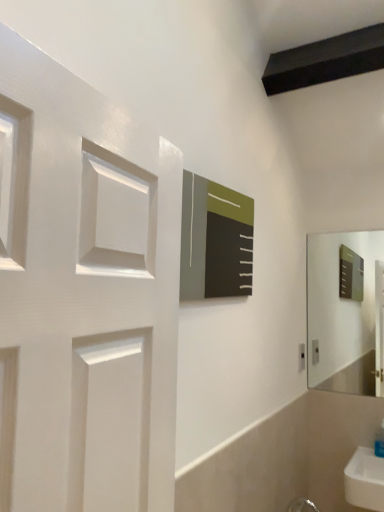
You are a GUI agent. You are given a task and a screenshot of the screen. Output one action in this format:
    pyautogui.click(x=<x>, y=<y>)
    Task: Click on the matte black bulletin board at upper center
    The image size is (384, 512).
    Given the screenshot: What is the action you would take?
    pyautogui.click(x=215, y=240)

Describe the element at coordinates (215, 240) in the screenshot. This screenshot has width=384, height=512. I see `matte black bulletin board at upper center` at that location.

Locate an element on the screen. This screenshot has height=512, width=384. matte black bulletin board at upper center is located at coordinates (215, 240).